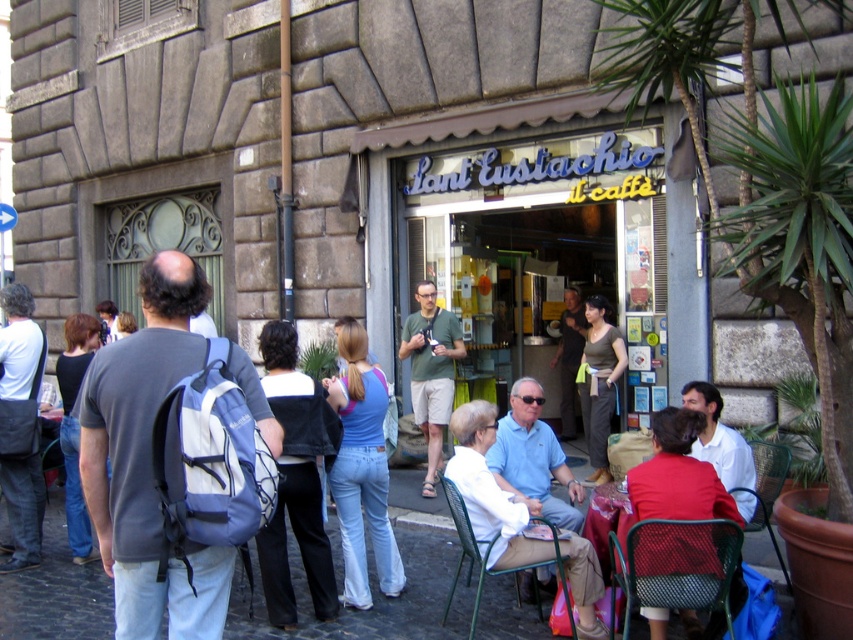
Question: Among these points, which one is nearest to the camera?

Choices:
 (A) pos(560,401)
 (B) pos(82,369)
 (C) pos(1,467)
 (D) pos(534,586)

Answer: (D)

Question: Does smooth stone pavement at center have a larger size compared to denim jeans at left?

Choices:
 (A) yes
 (B) no

Answer: (B)

Question: Is mesh fabric chair at lower right above metallic mesh chair at lower right?

Choices:
 (A) no
 (B) yes

Answer: (B)

Question: From the image, what is the correct spatial relationship of white fabric bag at left in relation to red fabric jacket at lower right?

Choices:
 (A) left
 (B) right

Answer: (A)

Question: Which point is farther to the camera?

Choices:
 (A) smooth stone pavement at center
 (B) denim jeans at left
 (C) green mesh chair at lower center
 (D) blue glass storefront at center

Answer: (D)

Question: Which point is farther from the camera taking this photo?

Choices:
 (A) (578, 124)
 (B) (610, 538)
 (C) (74, 316)
 (D) (770, 465)

Answer: (A)